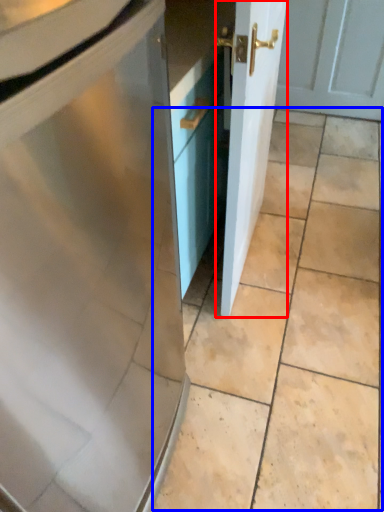
Question: Which object is further to the camera taking this photo, door (highlighted by a red box) or ceramic tile (highlighted by a blue box)?

Choices:
 (A) door
 (B) ceramic tile

Answer: (B)